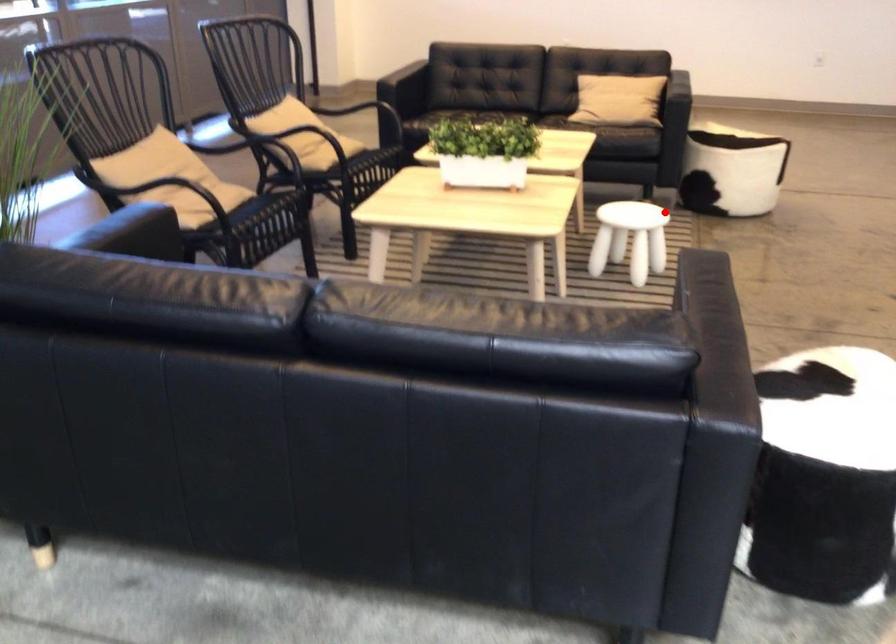
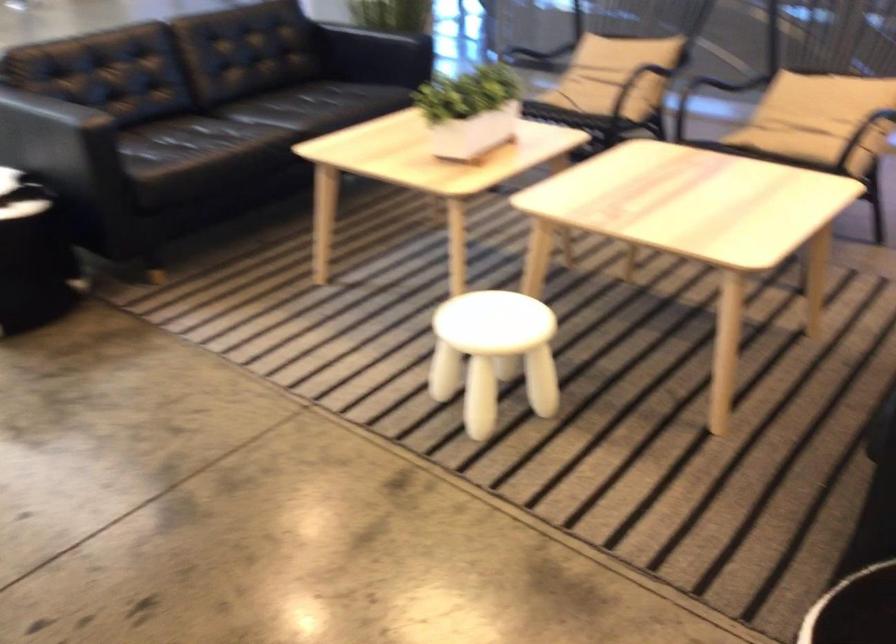
Question: I am providing you with two images of the same scene from different viewpoints. In image1, a red point is highlighted. Considering the same 3D point in image2, which of the following is correct?

Choices:
 (A) It is closer
 (B) It is farther

Answer: (A)